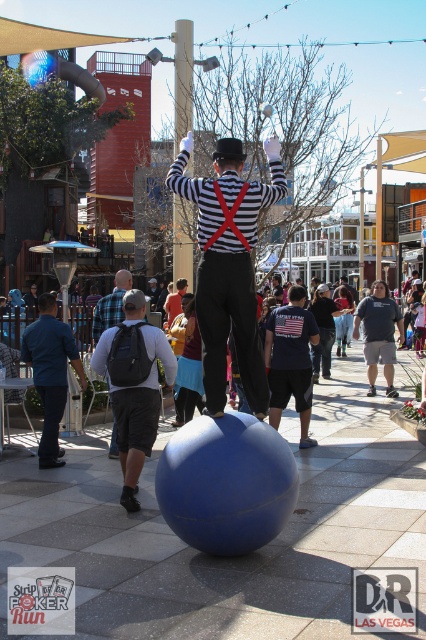
You are a photographer trying to capture both the striped fabric magician at center and the dark gray backpack at center in a single frame. Which object should you adjust your camera angle to focus on first to ensure both are in the shot?

Since the striped fabric magician at center is narrower than the dark gray backpack at center, you should focus on the wider dark gray backpack at center first to ensure both fit within the frame.

You are a photographer at the event and want to capture both the blue denim shirt at lower left and the dark gray backpack at center in the same frame. Which object should you position closer to the left side of your camera viewfinder?

The blue denim shirt at lower left should be positioned closer to the left side of your camera viewfinder since it is located on the left side of the dark gray backpack at center.

You are a photographer trying to capture both the blue denim shirt at lower left and the dark gray backpack at center in a single frame. Which object should you focus on first to ensure both are in the frame?

The blue denim shirt at lower left is smaller in size compared to the dark gray backpack at center. To ensure both are in the frame, focus on the larger object first, which is the dark gray backpack at center, then adjust to include the smaller blue denim shirt at lower left.